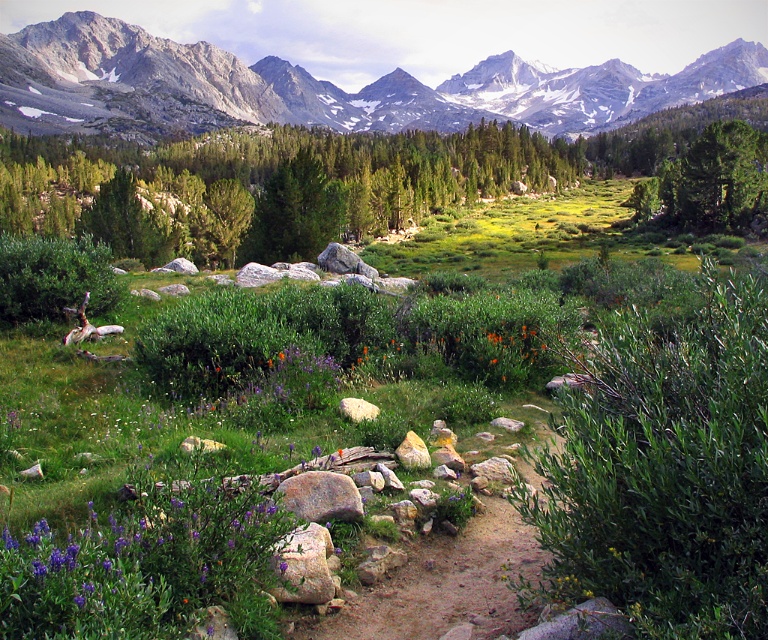
Which is more to the left, green leafy bush at center-right or rusty metallic rock at center?

From the viewer's perspective, rusty metallic rock at center appears more on the left side.

Is point (747, 532) farther from viewer compared to point (285, 593)?

No, it is not.

What are the coordinates of `green leafy bush at center-right` in the screenshot? It's located at (664, 467).

Is green textured tree at upper right taller than rusty metallic rock at center?

Yes.

What do you see at coordinates (709, 182) in the screenshot? I see `green textured tree at upper right` at bounding box center [709, 182].

What do you see at coordinates (709, 182) in the screenshot?
I see `green textured tree at upper right` at bounding box center [709, 182].

Locate an element on the screen. The width and height of the screenshot is (768, 640). green textured tree at upper right is located at coordinates (709, 182).

Between point (71, 144) and point (733, 141), which one is positioned in front?

Point (733, 141)

Is green leafy tree at center shorter than green textured tree at upper right?

Incorrect, green leafy tree at center's height does not fall short of green textured tree at upper right's.

What do you see at coordinates (280, 164) in the screenshot?
I see `green leafy tree at center` at bounding box center [280, 164].

The width and height of the screenshot is (768, 640). Identify the location of green leafy tree at center. (280, 164).